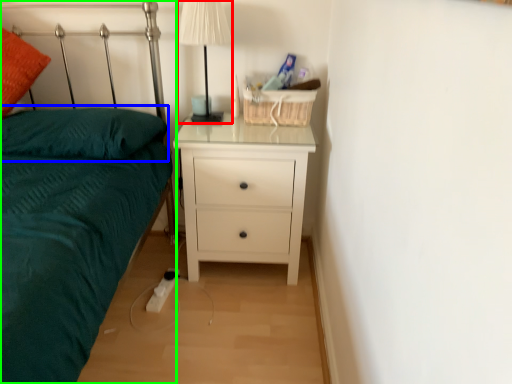
Question: Which is nearer to the table lamp (highlighted by a red box)? pillow (highlighted by a blue box) or bed (highlighted by a green box).

Choices:
 (A) pillow
 (B) bed

Answer: (A)